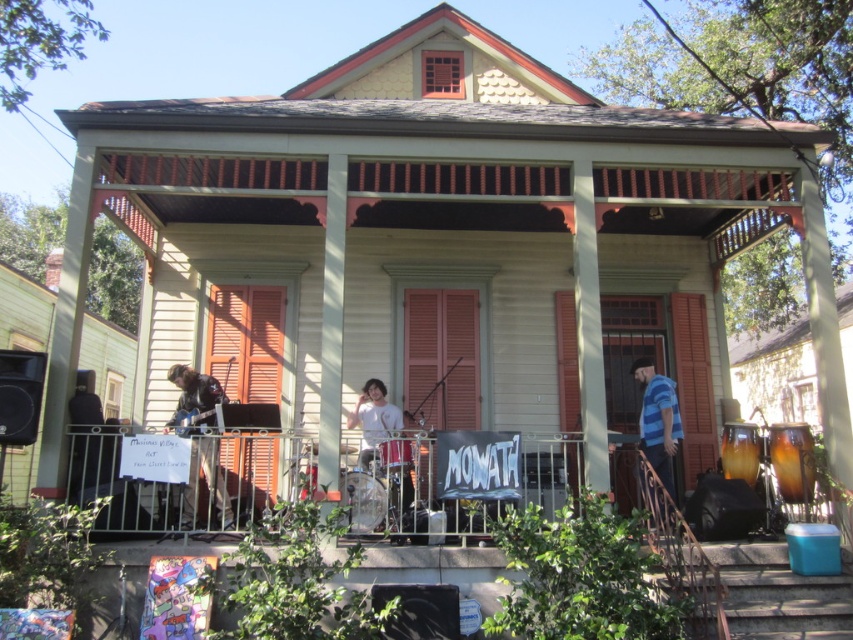
Measure the distance from blue striped shirt at right to shiny metallic drum at center.

blue striped shirt at right is 3.07 meters away from shiny metallic drum at center.

Who is higher up, blue striped shirt at right or shiny metallic drum at center?

shiny metallic drum at center is above.

Which is behind, point (637, 372) or point (397, 449)?

The point (637, 372) is behind.

Where is `blue striped shirt at right`? The width and height of the screenshot is (853, 640). blue striped shirt at right is located at coordinates (659, 420).

Does point (219, 496) come closer to viewer compared to point (390, 440)?

No, it is not.

Looking at this image, is leather jacket at left positioned before shiny metallic drum at center?

That is True.

Who is more forward, (173, 419) or (403, 464)?

Positioned in front is point (403, 464).

Locate an element on the screen. leather jacket at left is located at coordinates point(200,440).

Between white matte shirt at center and shiny metallic drum at center, which one has less height?

shiny metallic drum at center is shorter.

Is the position of white matte shirt at center more distant than that of shiny metallic drum at center?

That is True.

Is point (366, 417) closer to viewer compared to point (407, 468)?

No, it is not.

Find the location of a particular element. The image size is (853, 640). white matte shirt at center is located at coordinates (373, 419).